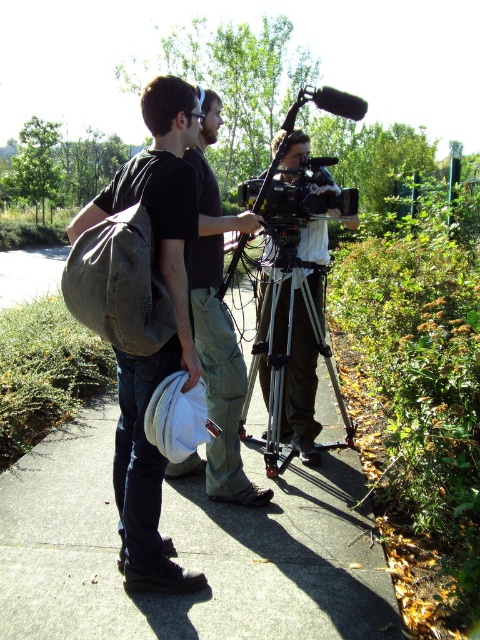
Who is more distant from viewer, (201, 237) or (324, 269)?

The point (324, 269) is behind.

Which is more to the right, matte black backpack at center or silver metallic tripod at center?

From the viewer's perspective, silver metallic tripod at center appears more on the right side.

Between point (214, 289) and point (271, 420), which one is positioned behind?

Point (271, 420)

The width and height of the screenshot is (480, 640). What are the coordinates of `matte black backpack at center` in the screenshot? It's located at (216, 332).

Is canvas backpack at left smaller than silver metallic tripod at center?

Actually, canvas backpack at left might be larger than silver metallic tripod at center.

Is canvas backpack at left positioned behind silver metallic tripod at center?

No, it is not.

Who is more forward, (x=180, y=365) or (x=261, y=285)?

Point (x=180, y=365) is in front.

This screenshot has width=480, height=640. Find the location of `canvas backpack at left`. canvas backpack at left is located at coordinates (143, 314).

Does canvas backpack at left appear on the left side of matte black backpack at center?

Correct, you'll find canvas backpack at left to the left of matte black backpack at center.

In order to click on canvas backpack at left in this screenshot , I will do `click(143, 314)`.